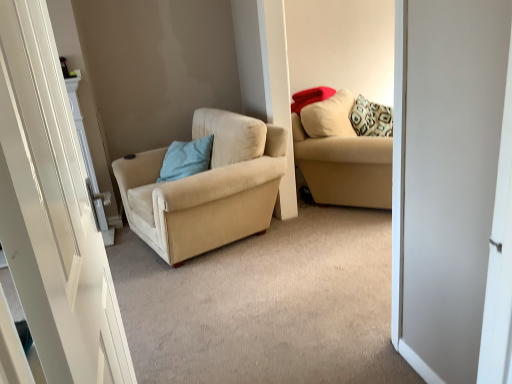
I want to click on white glossy door at left, so point(52,211).

In order to face matte red pillow at upper right, arranged as the 1th pillow when viewed from the right, should I rotate leftwards or rightwards?

To face it directly, rotate right by 7.915 degrees.

Describe the element at coordinates (186, 159) in the screenshot. I see `light blue fabric pillow at center, acting as the second pillow starting from the right` at that location.

At what (x,y) coordinates should I click in order to perform the action: click on light blue fabric pillow at center, which is the first pillow in bottom-to-top order. Please return your answer as a coordinate pair (x, y). Looking at the image, I should click on (186, 159).

You are a GUI agent. You are given a task and a screenshot of the screen. Output one action in this format:
    pyautogui.click(x=<x>, y=<y>)
    Task: Click on the white glossy door at left
    This screenshot has width=512, height=384.
    Given the screenshot: What is the action you would take?
    pyautogui.click(x=52, y=211)

From a real-world perspective, which object rests below the other?

In real-world perspective, beige fabric couch at upper right is lower.

Considering the sizes of objects beige fabric couch at upper right and white glossy door at left in the image provided, who is wider, beige fabric couch at upper right or white glossy door at left?

With larger width is beige fabric couch at upper right.

Can you confirm if beige fabric couch at upper right is positioned to the left of white glossy door at left?

No.

Between beige fabric couch at upper right and white glossy door at left, which one is positioned in front?

white glossy door at left is closer to the camera.

Looking at this image, from a real-world perspective, is light blue fabric pillow at center, arranged as the first pillow when viewed from the left, positioned over beige fabric couch at upper right based on gravity?

Yes, from a real-world perspective, light blue fabric pillow at center, arranged as the first pillow when viewed from the left, is over beige fabric couch at upper right

Is light blue fabric pillow at center, arranged as the first pillow when viewed from the left, oriented away from beige fabric couch at upper right?

No, beige fabric couch at upper right is not at the back of light blue fabric pillow at center, arranged as the first pillow when viewed from the left.

In the scene shown: Considering the sizes of objects light blue fabric pillow at center, arranged as the first pillow when viewed from the left, and beige fabric couch at upper right in the image provided, who is shorter, light blue fabric pillow at center, arranged as the first pillow when viewed from the left, or beige fabric couch at upper right?

Standing shorter between the two is light blue fabric pillow at center, arranged as the first pillow when viewed from the left.

Are light blue fabric pillow at center, which is the first pillow in bottom-to-top order, and beige fabric couch at upper right located far from each other?

They are positioned close to each other.

Consider the image. Is beige fabric couch at upper right looking in the opposite direction of beige fabric chair at center?

No, beige fabric couch at upper right is not facing away from beige fabric chair at center.

Is point (294, 123) closer or farther from the camera than point (154, 207)?

Point (294, 123) appears to be farther away from the viewer than point (154, 207).

Would you say beige fabric couch at upper right is outside beige fabric chair at center?

Yes.

Considering the sizes of beige fabric couch at upper right and beige fabric chair at center in the image, is beige fabric couch at upper right taller or shorter than beige fabric chair at center?

Considering their sizes, beige fabric couch at upper right has more height than beige fabric chair at center.

Does beige fabric chair at center turn towards white glossy door at left?

No.

From the image's perspective, between beige fabric chair at center and white glossy door at left, which one is located above?

beige fabric chair at center appears higher in the image.

From a real-world perspective, who is located lower, beige fabric chair at center or white glossy door at left?

beige fabric chair at center, from a real-world perspective.

Considering the relative sizes of beige fabric chair at center and white glossy door at left in the image provided, is beige fabric chair at center bigger than white glossy door at left?

Correct, beige fabric chair at center is larger in size than white glossy door at left.

Looking at this image, from their relative heights in the image, would you say light blue fabric pillow at center, arranged as the first pillow when viewed from the left, is taller or shorter than matte red pillow at upper right, which ranks as the second pillow in left-to-right order?

Considering their sizes, light blue fabric pillow at center, arranged as the first pillow when viewed from the left, has more height than matte red pillow at upper right, which ranks as the second pillow in left-to-right order.

Is light blue fabric pillow at center, acting as the second pillow starting from the right, wider than matte red pillow at upper right, which ranks as the second pillow in left-to-right order?

Yes.

Is point (163, 181) more distant than point (323, 93)?

No, (163, 181) is in front of (323, 93).

Is light blue fabric pillow at center, arranged as the first pillow when viewed from the left, positioned far away from matte red pillow at upper right, marked as the first pillow in a top-to-bottom arrangement?

They are positioned close to each other.

Between matte red pillow at upper right, placed as the 2th pillow when sorted from bottom to top, and white glossy door at left, which one appears on the right side from the viewer's perspective?

From the viewer's perspective, matte red pillow at upper right, placed as the 2th pillow when sorted from bottom to top, appears more on the right side.

From the image's perspective, which object appears higher, matte red pillow at upper right, placed as the 2th pillow when sorted from bottom to top, or white glossy door at left?

matte red pillow at upper right, placed as the 2th pillow when sorted from bottom to top, from the image's perspective.

Can you confirm if matte red pillow at upper right, arranged as the 1th pillow when viewed from the right, is bigger than white glossy door at left?

No.

From a real-world perspective, is matte red pillow at upper right, placed as the 2th pillow when sorted from bottom to top, on top of white glossy door at left?

Indeed, from a real-world perspective, matte red pillow at upper right, placed as the 2th pillow when sorted from bottom to top, stands above white glossy door at left.

From a real-world perspective, which is physically below, light blue fabric pillow at center, which is the first pillow in bottom-to-top order, or beige fabric chair at center?

beige fabric chair at center, from a real-world perspective.

Looking at this image, between light blue fabric pillow at center, the 2th pillow when ordered from top to bottom, and beige fabric chair at center, which one has larger width?

Wider between the two is beige fabric chair at center.

Is there a large distance between light blue fabric pillow at center, acting as the second pillow starting from the right, and beige fabric chair at center?

That's not correct — light blue fabric pillow at center, acting as the second pillow starting from the right, is a little close to beige fabric chair at center.

Does light blue fabric pillow at center, arranged as the first pillow when viewed from the left, have a smaller size compared to beige fabric chair at center?

Yes, light blue fabric pillow at center, arranged as the first pillow when viewed from the left, is smaller than beige fabric chair at center.

Locate an element on the screen. This screenshot has height=384, width=512. studio couch on the right of the white glossy door at left is located at coordinates (342, 156).

Image resolution: width=512 pixels, height=384 pixels. I want to click on studio couch in front of the light blue fabric pillow at center, the 2th pillow when ordered from top to bottom, so tap(342, 156).

Based on their spatial positions, is beige fabric couch at upper right or beige fabric chair at center further from light blue fabric pillow at center, the 2th pillow when ordered from top to bottom?

Based on the image, beige fabric couch at upper right appears to be further to light blue fabric pillow at center, the 2th pillow when ordered from top to bottom.

Looking at the image, which one is located further to light blue fabric pillow at center, the 2th pillow when ordered from top to bottom, beige fabric chair at center or matte red pillow at upper right, marked as the first pillow in a top-to-bottom arrangement?

matte red pillow at upper right, marked as the first pillow in a top-to-bottom arrangement, lies further to light blue fabric pillow at center, the 2th pillow when ordered from top to bottom, than the other object.

Based on their spatial positions, is matte red pillow at upper right, which ranks as the second pillow in left-to-right order, or white glossy door at left further from light blue fabric pillow at center, the 2th pillow when ordered from top to bottom?

white glossy door at left.

Looking at the image, which one is located closer to beige fabric couch at upper right, white glossy door at left or matte red pillow at upper right, which ranks as the second pillow in left-to-right order?

matte red pillow at upper right, which ranks as the second pillow in left-to-right order, is closer to beige fabric couch at upper right.

When comparing their distances from white glossy door at left, does beige fabric couch at upper right or matte red pillow at upper right, placed as the 2th pillow when sorted from bottom to top, seem further?

The object further to white glossy door at left is matte red pillow at upper right, placed as the 2th pillow when sorted from bottom to top.

Estimate the real-world distances between objects in this image. Which object is closer to matte red pillow at upper right, placed as the 2th pillow when sorted from bottom to top, light blue fabric pillow at center, arranged as the first pillow when viewed from the left, or beige fabric chair at center?

light blue fabric pillow at center, arranged as the first pillow when viewed from the left.

Looking at the image, which one is located closer to beige fabric chair at center, matte red pillow at upper right, marked as the first pillow in a top-to-bottom arrangement, or light blue fabric pillow at center, the 2th pillow when ordered from top to bottom?

Among the two, light blue fabric pillow at center, the 2th pillow when ordered from top to bottom, is located nearer to beige fabric chair at center.

When comparing their distances from beige fabric couch at upper right, does beige fabric chair at center or matte red pillow at upper right, arranged as the 1th pillow when viewed from the right, seem further?

The object further to beige fabric couch at upper right is beige fabric chair at center.

You are a GUI agent. You are given a task and a screenshot of the screen. Output one action in this format:
    pyautogui.click(x=<x>, y=<y>)
    Task: Click on the studio couch between white glossy door at left and light blue fabric pillow at center, acting as the second pillow starting from the right, from front to back
    
    Given the screenshot: What is the action you would take?
    pyautogui.click(x=342, y=156)

Where is `pillow positioned between white glossy door at left and matte red pillow at upper right, arranged as the 1th pillow when viewed from the right, from near to far`? pillow positioned between white glossy door at left and matte red pillow at upper right, arranged as the 1th pillow when viewed from the right, from near to far is located at coordinates (186, 159).

Locate an element on the screen. This screenshot has width=512, height=384. chair between white glossy door at left and beige fabric couch at upper right from front to back is located at coordinates (206, 188).

Find the location of a particular element. chair between light blue fabric pillow at center, the 2th pillow when ordered from top to bottom, and beige fabric couch at upper right, in the horizontal direction is located at coordinates (206, 188).